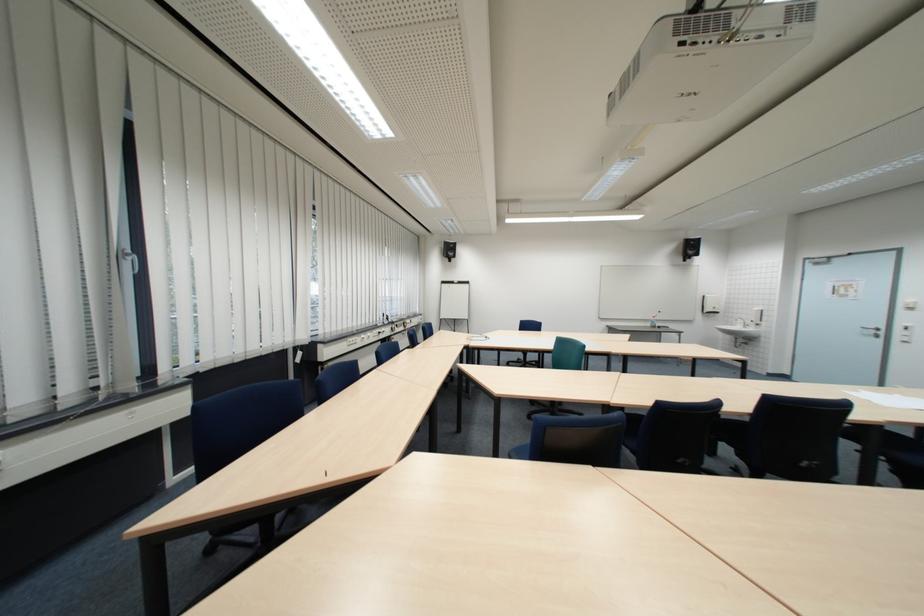
The height and width of the screenshot is (616, 924). Find the location of `faucet handle`. faucet handle is located at coordinates (739, 321).